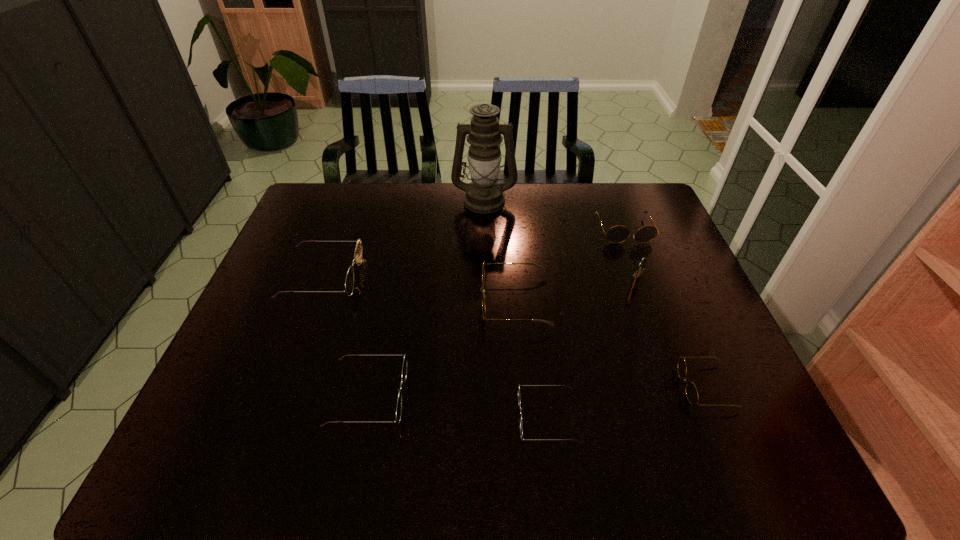
You are a GUI agent. You are given a task and a screenshot of the screen. Output one action in this format:
    pyautogui.click(x=<x>, y=<y>)
    Task: Click on the seventh closest object to the padlock
    Image resolution: width=960 pixels, height=540 pixels.
    Given the screenshot: What is the action you would take?
    pyautogui.click(x=358, y=253)

The image size is (960, 540). Find the location of `the seventh closest object to the nearest gray sunglasses`. the seventh closest object to the nearest gray sunglasses is located at coordinates (358, 253).

Where is `the sixth closest sunglasses to the oil lamp`? This screenshot has width=960, height=540. the sixth closest sunglasses to the oil lamp is located at coordinates (691, 391).

Identify which sunglasses is located as the fifth nearest to the rightmost green sunglasses. Please provide its 2D coordinates. Your answer should be formatted as a tuple, i.e. [(x, y)], where the tuple contains the x and y coordinates of a point satisfying the conditions above.

[(617, 234)]

I want to click on gray sunglasses that is the closest to the second biggest gray sunglasses, so click(x=541, y=267).

Where is `gray sunglasses identified as the closest to the leftmost gray sunglasses`? Image resolution: width=960 pixels, height=540 pixels. gray sunglasses identified as the closest to the leftmost gray sunglasses is located at coordinates (617, 234).

Identify which green sunglasses is the second closest to the second biggest green sunglasses. Please provide its 2D coordinates. Your answer should be formatted as a tuple, i.e. [(x, y)], where the tuple contains the x and y coordinates of a point satisfying the conditions above.

[(519, 401)]

Select which green sunglasses is the second closest to the shortest sunglasses. Please provide its 2D coordinates. Your answer should be formatted as a tuple, i.e. [(x, y)], where the tuple contains the x and y coordinates of a point satisfying the conditions above.

[(358, 253)]

I want to click on free space that satisfies the following two spatial constraints: 1. on the front side of the farthest object; 2. on the front-facing side of the fifth sunglasses from right to left, so click(487, 395).

Where is `blank area in the image that satisfies the following two spatial constraints: 1. on the lenses of the farthest gray sunglasses; 2. on the front-facing side of the fifth sunglasses from right to left`? The image size is (960, 540). blank area in the image that satisfies the following two spatial constraints: 1. on the lenses of the farthest gray sunglasses; 2. on the front-facing side of the fifth sunglasses from right to left is located at coordinates (687, 395).